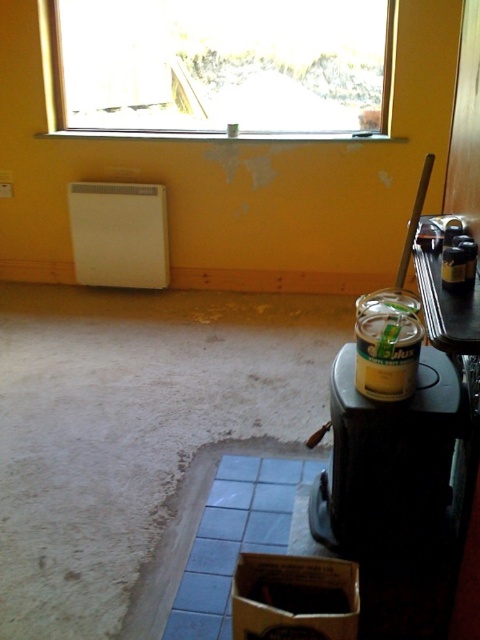
You are navigating through the construction site and need to move from point A to point B. The two points are labeled as point (74, 120) and point (431, 515). According to the coordinates, which point is located further back in the scene?

Point (74, 120) is behind point (431, 515), so it is further back in the scene.

You are a painter needing to reach both the transparent glass window at upper center and the yellow matte paint can at lower right. Which object is higher up in the room?

The transparent glass window at upper center is higher up in the room than the yellow matte paint can at lower right.